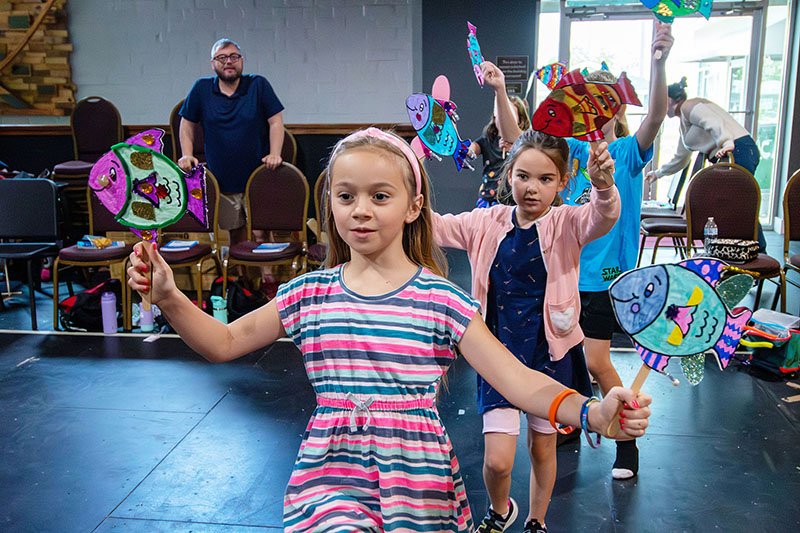
Locate an element on the screen. The width and height of the screenshot is (800, 533). blue floor is located at coordinates (85, 442).